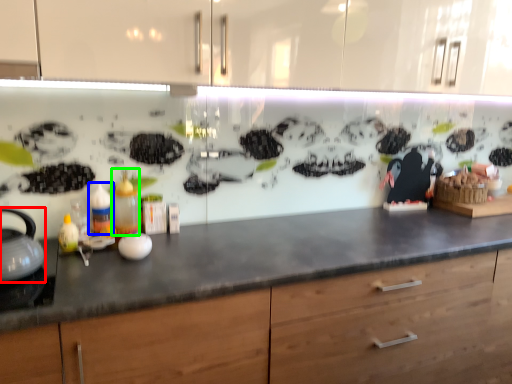
Question: Considering the real-world distances, which object is farthest from tea pot (highlighted by a red box)? bottle (highlighted by a blue box) or bottle (highlighted by a green box)?

Choices:
 (A) bottle
 (B) bottle

Answer: (B)